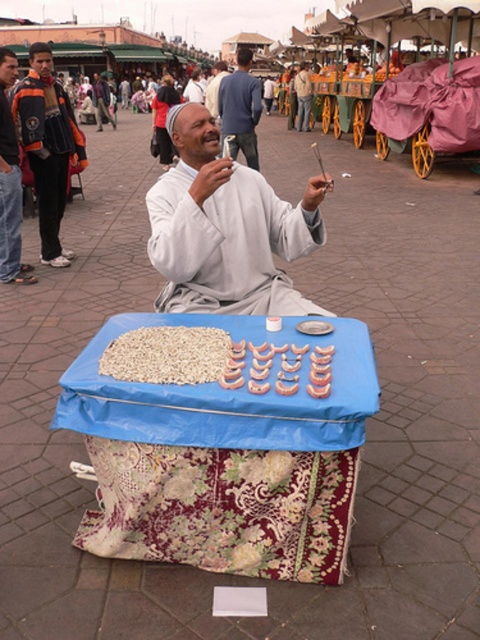
Does gray cotton man at center have a lesser width compared to light brown grain at center?

In fact, gray cotton man at center might be wider than light brown grain at center.

Who is higher up, gray cotton man at center or light brown grain at center?

gray cotton man at center is above.

Who is more forward, (266, 230) or (135, 340)?

Positioned in front is point (135, 340).

Locate an element on the screen. The image size is (480, 640). gray cotton man at center is located at coordinates (226, 228).

Can you confirm if light blue fabric at center is taller than matte gray shirt at center?

Correct, light blue fabric at center is much taller as matte gray shirt at center.

Is light blue fabric at center thinner than matte gray shirt at center?

Yes, light blue fabric at center is thinner than matte gray shirt at center.

The width and height of the screenshot is (480, 640). I want to click on light blue fabric at center, so click(x=240, y=109).

You are a GUI agent. You are given a task and a screenshot of the screen. Output one action in this format:
    pyautogui.click(x=<x>, y=<y>)
    Task: Click on the light blue fabric at center
    This screenshot has width=480, height=640.
    Given the screenshot: What is the action you would take?
    (240, 109)

Can you confirm if gray cotton man at center is positioned below light blue fabric at center?

Yes.

From the picture: Is gray cotton man at center above light blue fabric at center?

No.

Is point (321, 234) in front of point (239, 93)?

Yes, point (321, 234) is in front of point (239, 93).

Where is `gray cotton man at center`? The width and height of the screenshot is (480, 640). gray cotton man at center is located at coordinates (226, 228).